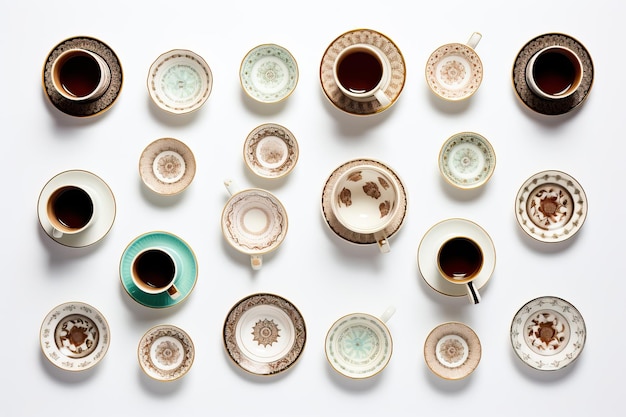
The height and width of the screenshot is (417, 626). I want to click on cups, so pyautogui.click(x=72, y=89), pyautogui.click(x=67, y=226), pyautogui.click(x=141, y=278), pyautogui.click(x=357, y=194), pyautogui.click(x=464, y=62), pyautogui.click(x=347, y=67), pyautogui.click(x=558, y=66), pyautogui.click(x=461, y=256), pyautogui.click(x=245, y=231).